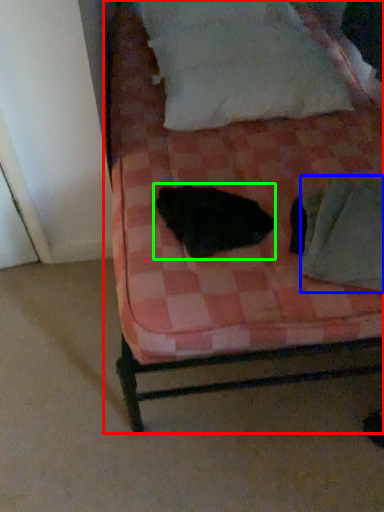
Question: Which object is the closest to the bed (highlighted by a red box)? Choose among these: linen (highlighted by a blue box) or animal (highlighted by a green box).

Choices:
 (A) linen
 (B) animal

Answer: (B)